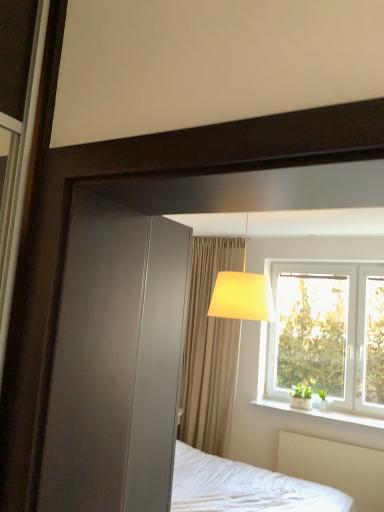
Question: Is white plastic window at upper right located outside matte yellow fabric lampshade at upper center?

Choices:
 (A) yes
 (B) no

Answer: (A)

Question: Is white plastic window at upper right looking in the opposite direction of matte yellow fabric lampshade at upper center?

Choices:
 (A) no
 (B) yes

Answer: (A)

Question: Does white plastic window at upper right have a lesser width compared to matte yellow fabric lampshade at upper center?

Choices:
 (A) no
 (B) yes

Answer: (B)

Question: Considering the relative sizes of white plastic window at upper right and matte yellow fabric lampshade at upper center in the image provided, is white plastic window at upper right wider than matte yellow fabric lampshade at upper center?

Choices:
 (A) yes
 (B) no

Answer: (B)

Question: Considering the relative sizes of white plastic window at upper right and matte yellow fabric lampshade at upper center in the image provided, is white plastic window at upper right taller than matte yellow fabric lampshade at upper center?

Choices:
 (A) no
 (B) yes

Answer: (B)

Question: Is white plastic window at upper right aimed at matte yellow fabric lampshade at upper center?

Choices:
 (A) yes
 (B) no

Answer: (A)

Question: Considering the relative positions of white textured radiator at lower right and beige fabric curtain at center in the image provided, is white textured radiator at lower right to the right of beige fabric curtain at center from the viewer's perspective?

Choices:
 (A) yes
 (B) no

Answer: (A)

Question: Could beige fabric curtain at center be considered to be inside white textured radiator at lower right?

Choices:
 (A) no
 (B) yes

Answer: (A)

Question: Considering the relative positions of white textured radiator at lower right and beige fabric curtain at center in the image provided, is white textured radiator at lower right behind beige fabric curtain at center?

Choices:
 (A) no
 (B) yes

Answer: (A)

Question: Is white textured radiator at lower right positioned with its back to beige fabric curtain at center?

Choices:
 (A) yes
 (B) no

Answer: (B)

Question: Could you tell me if white textured radiator at lower right is turned towards beige fabric curtain at center?

Choices:
 (A) no
 (B) yes

Answer: (A)

Question: From a real-world perspective, is white textured radiator at lower right physically below beige fabric curtain at center?

Choices:
 (A) no
 (B) yes

Answer: (B)

Question: Is beige fabric curtain at center bigger than white textured radiator at lower right?

Choices:
 (A) yes
 (B) no

Answer: (A)